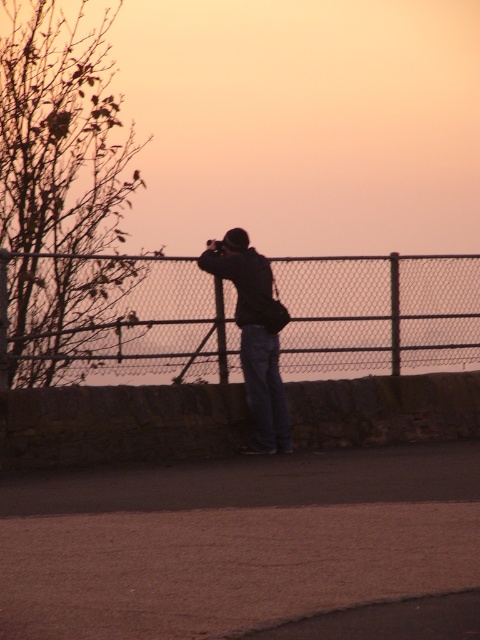
Question: Is metallic chain-link fence at center smaller than dark blue jeans at center?

Choices:
 (A) no
 (B) yes

Answer: (A)

Question: Among these objects, which one is farthest from the camera?

Choices:
 (A) metallic chain-link fence at center
 (B) dark blue jeans at center

Answer: (B)

Question: Is metallic chain-link fence at center further to camera compared to dark blue jeans at center?

Choices:
 (A) yes
 (B) no

Answer: (B)

Question: Which of the following is the farthest from the observer?

Choices:
 (A) metallic chain-link fence at center
 (B) dark blue jeans at center

Answer: (B)

Question: Can you confirm if metallic chain-link fence at center is wider than dark blue jeans at center?

Choices:
 (A) no
 (B) yes

Answer: (B)